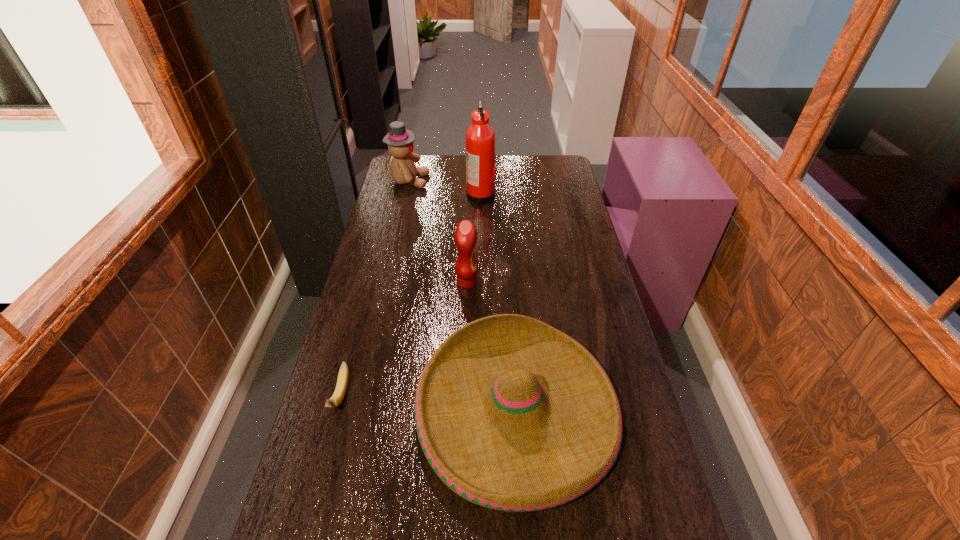
In order to click on vacant point that satisfies the following two spatial constraints: 1. at the stem of the banana; 2. on the right side of the fourth tallest object in this screenshot , I will do `click(337, 410)`.

What are the coordinates of `blank space that satisfies the following two spatial constraints: 1. on the label side of the second shortest object; 2. on the left side of the third nearest object` in the screenshot? It's located at (463, 410).

At what (x,y) coordinates should I click in order to perform the action: click on free point that satisfies the following two spatial constraints: 1. on the label side of the tallest object; 2. on the back side of the fourth tallest object. Please return your answer as a coordinate pair (x, y). The image size is (960, 540). Looking at the image, I should click on (481, 410).

Locate an element on the screen. Image resolution: width=960 pixels, height=540 pixels. vacant area in the image that satisfies the following two spatial constraints: 1. on the label side of the tallest object; 2. at the stem of the shortest object is located at coordinates (481, 396).

At what (x,y) coordinates should I click in order to perform the action: click on free space that satisfies the following two spatial constraints: 1. on the label side of the fourth tallest object; 2. on the left side of the third farthest object. Please return your answer as a coordinate pair (x, y). Looking at the image, I should click on (463, 410).